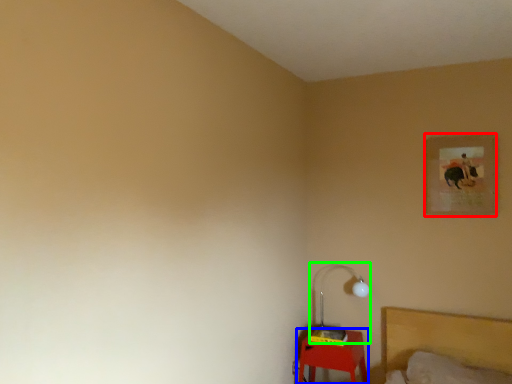
Question: Which object is the closest to the picture frame (highlighted by a red box)? Choose among these: furniture (highlighted by a blue box) or lamp (highlighted by a green box).

Choices:
 (A) furniture
 (B) lamp

Answer: (B)